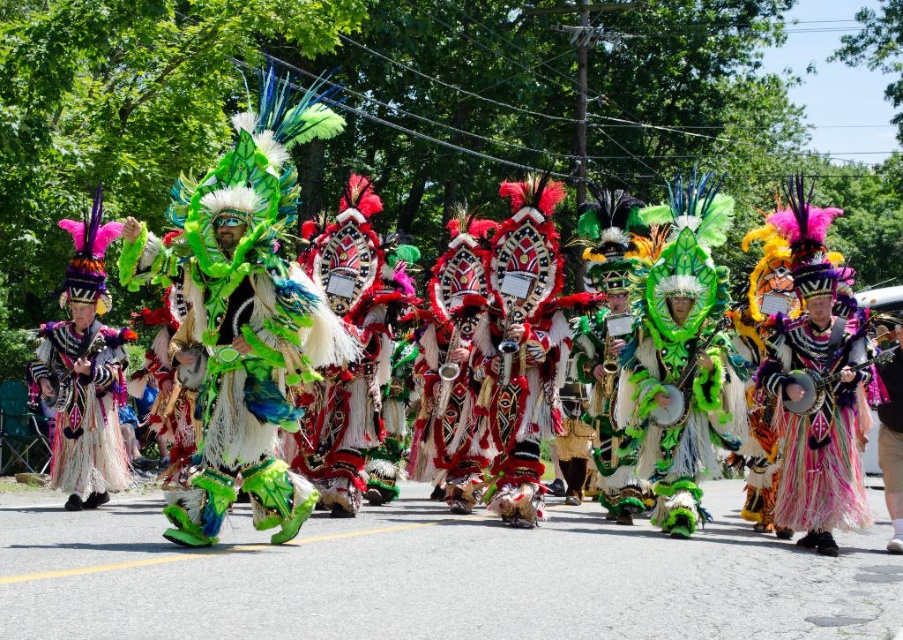
You are a photographer trying to capture the entire scene of the parade. You notice the shiny green feathers at center and the multicolored feathered headdress at center. Which object should you focus on to ensure both are visible in the frame?

The shiny green feathers at center occupies less space than the multicolored feathered headdress at center, so you should focus on the multicolored feathered headdress at center to ensure both are visible in the frame.

You are a photographer trying to capture the performers in the parade. You notice the shiny green feathers at center and the multicolored feathered headdress at center. Which object would you need to adjust your camera focus more carefully to capture the finer details?

The shiny green feathers at center is thinner than the multicolored feathered headdress at center, so you would need to adjust your camera focus more carefully on the shiny green feathers at center to capture its finer details.

You are a photographer at the parade and want to capture both the shiny green feathers at center and the shiny metallic headdress at left in a single frame. Which object should you focus on first to ensure both are visible in the photo?

The shiny green feathers at center is not as tall as the shiny metallic headdress at left, so focus on the shiny metallic headdress at left first to ensure both are visible in the photo.